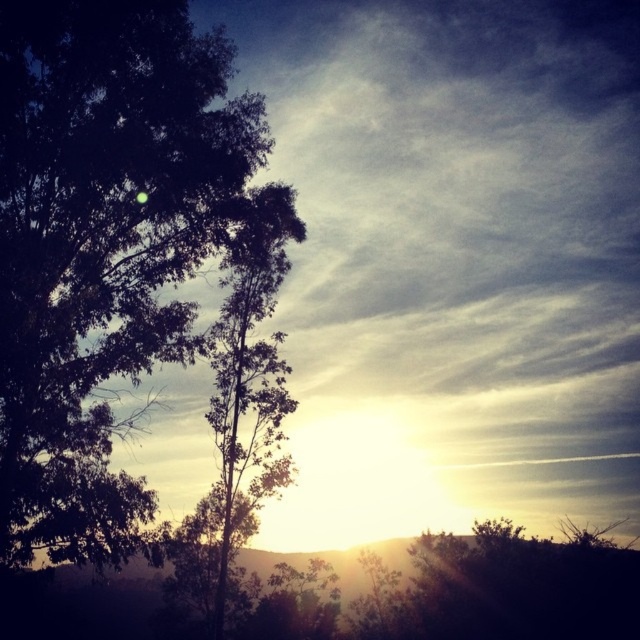
Based on the scene description and the coordinates provided, what object is located at point (106, 243)?

The dark green leafy tree at left is located at point (106, 243).